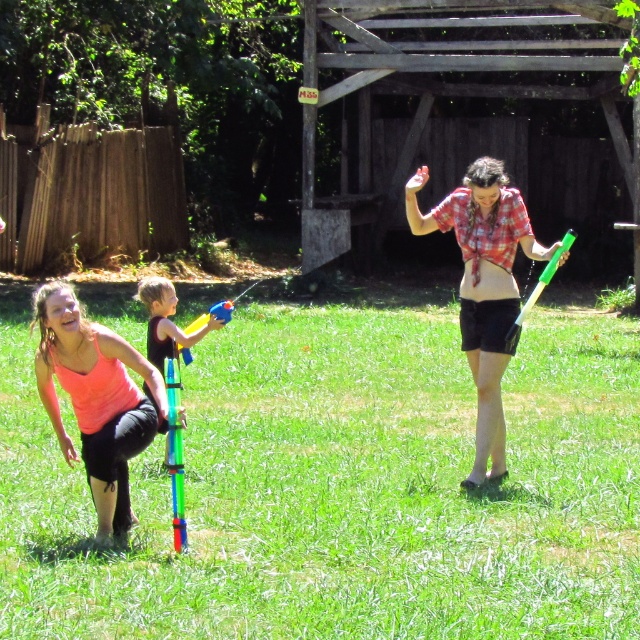
You are a photographer trying to capture a closeup of the pink matte tank top at lower left and the translucent plastic water gun at center. Which object should you zoom in on to ensure both are in focus without moving the camera?

The pink matte tank top at lower left has a smaller width than the translucent plastic water gun at center, so you should zoom in on the translucent plastic water gun at center to ensure both are in focus without moving the camera.

You are a photographer trying to capture a clear shot of the plaid shirt at center and the translucent plastic water gun at center. Which object should you focus on first to ensure it appears sharp in the photo?

You should focus on the plaid shirt at center first because it is closer to the viewer than the translucent plastic water gun at center, ensuring it will be in focus before adjusting for the other object.